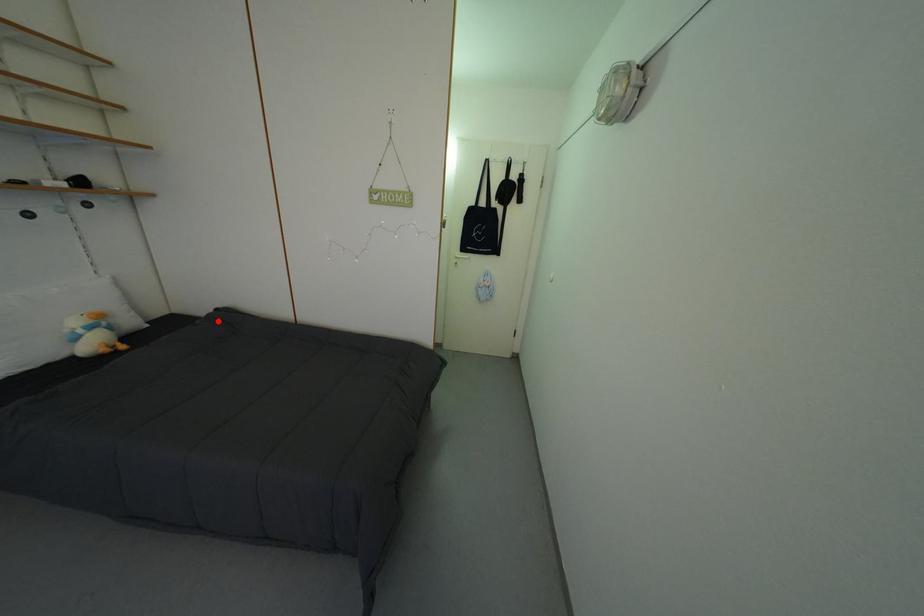
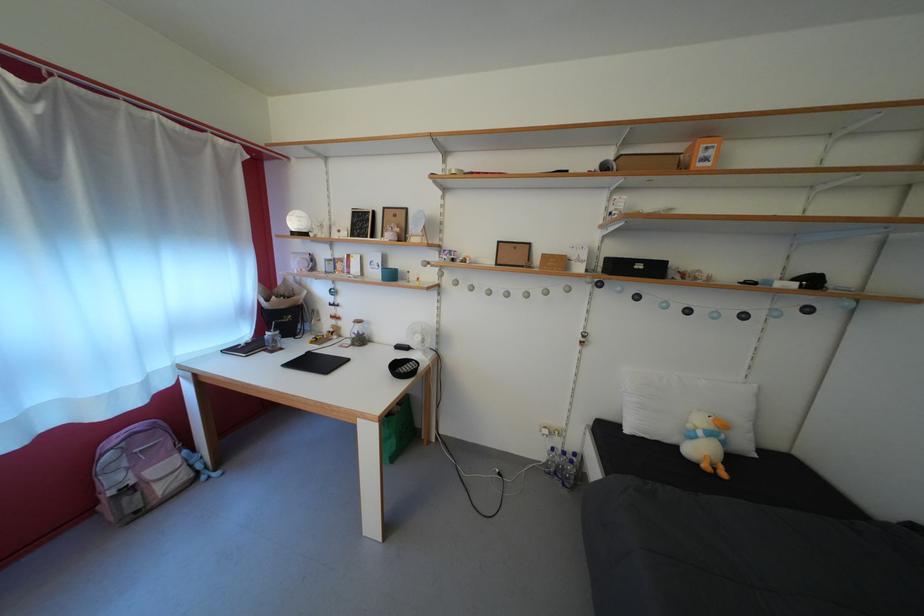
Question: I am providing you with two images of the same scene from different viewpoints. Image1 has a red point marked. In image2, the corresponding 3D location appears at what relative position? Reply with the corresponding letter.

Choices:
 (A) Closer
 (B) Farther

Answer: (A)